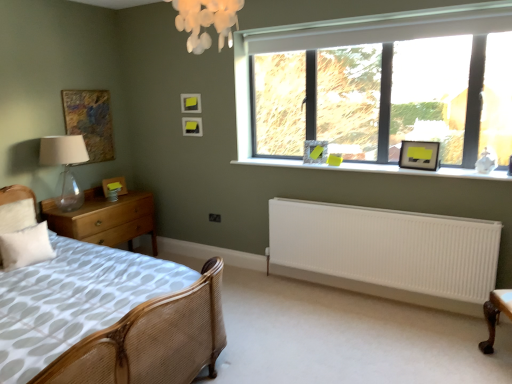
This screenshot has width=512, height=384. Identify the location of vacant area that is in front of matte black picture frame at upper right, the sixth picture frame when ordered from left to right. (431, 171).